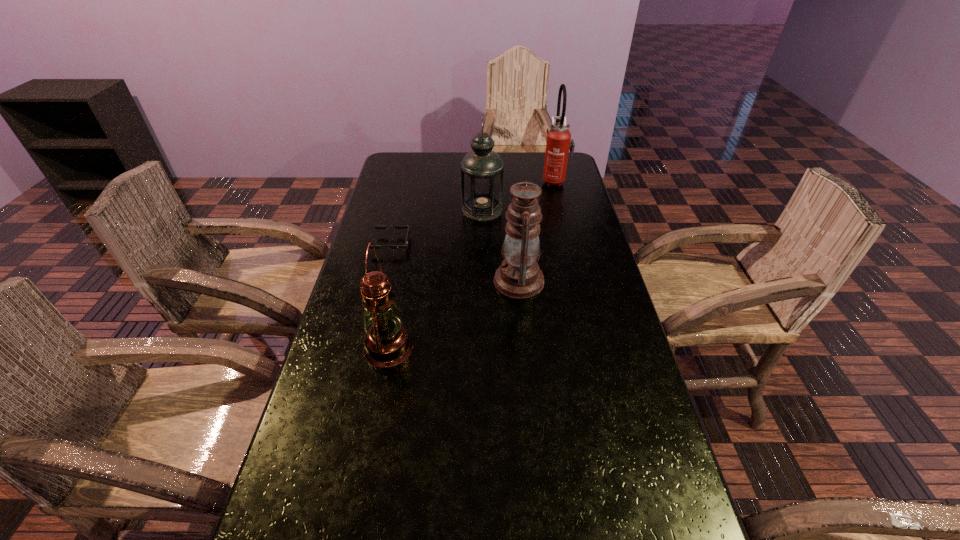
Locate which oil lamp ranks second in proximity to the second farthest oil lamp. Please provide its 2D coordinates. Your answer should be formatted as a tuple, i.e. [(x, y)], where the tuple contains the x and y coordinates of a point satisfying the conditions above.

[(387, 343)]

Image resolution: width=960 pixels, height=540 pixels. Find the location of `blank space that satisfies the following two spatial constraints: 1. at the nozzle of the fire extinguisher; 2. on the front side of the second nearest oil lamp`. blank space that satisfies the following two spatial constraints: 1. at the nozzle of the fire extinguisher; 2. on the front side of the second nearest oil lamp is located at coordinates (580, 281).

This screenshot has width=960, height=540. I want to click on vacant position in the image that satisfies the following two spatial constraints: 1. at the nozzle of the fire extinguisher; 2. on the front side of the second farthest oil lamp, so click(x=580, y=281).

Where is `free location that satisfies the following two spatial constraints: 1. on the temples of the shortest object; 2. on the back side of the nearest oil lamp`? The height and width of the screenshot is (540, 960). free location that satisfies the following two spatial constraints: 1. on the temples of the shortest object; 2. on the back side of the nearest oil lamp is located at coordinates (366, 348).